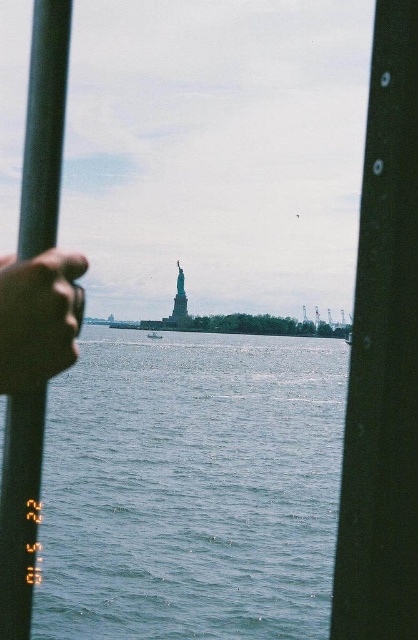
Who is more distant from viewer, (397, 243) or (18, 540)?

Positioned behind is point (18, 540).

Is point (402, 458) closer to camera compared to point (43, 64)?

That is True.

The width and height of the screenshot is (418, 640). I want to click on black matte pole at center, so click(382, 356).

Who is shorter, black matte pole at center or white plastic boat at center?

With less height is white plastic boat at center.

Can you confirm if black matte pole at center is thinner than white plastic boat at center?

No.

Locate an element on the screen. The width and height of the screenshot is (418, 640). black matte pole at center is located at coordinates (382, 356).

Looking at this image, who is more forward, (390, 221) or (12, 376)?

Point (390, 221) is in front.

Does black matte pole at center have a lesser width compared to smooth skin hand at center left?

Yes.

Describe the element at coordinates (382, 356) in the screenshot. I see `black matte pole at center` at that location.

Where is `black matte pole at center`? The image size is (418, 640). black matte pole at center is located at coordinates (382, 356).